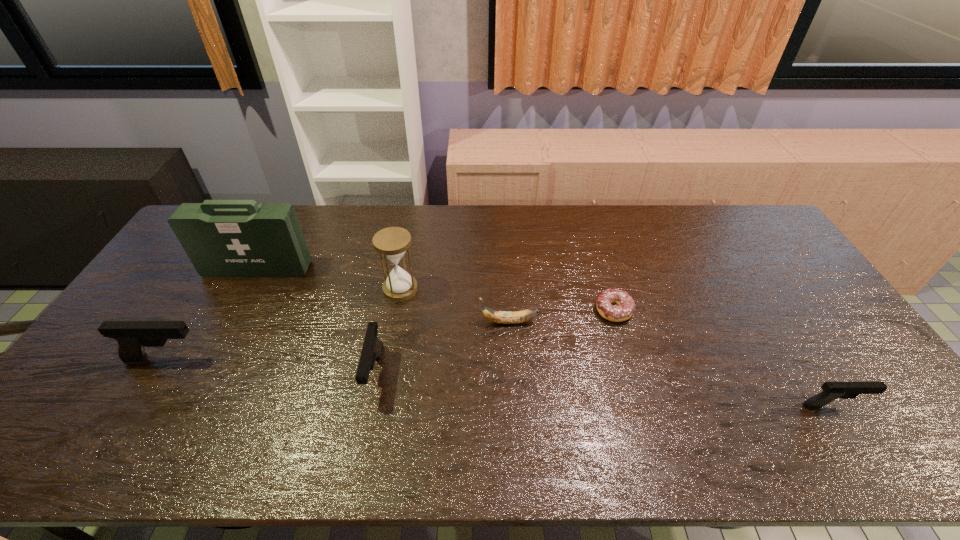
Find the location of a particular element. The height and width of the screenshot is (540, 960). banana is located at coordinates (502, 317).

This screenshot has width=960, height=540. I want to click on free spot located 0.390m on the front-facing side of the fifth shortest object, so click(351, 359).

You are a GUI agent. You are given a task and a screenshot of the screen. Output one action in this format:
    pyautogui.click(x=<x>, y=<y>)
    Task: Click on the free location located on the front-facing side of the rightmost pistol
    The width and height of the screenshot is (960, 540).
    Given the screenshot: What is the action you would take?
    pyautogui.click(x=888, y=406)

Where is `vacant space located 0.140m on the back of the second tallest object`? vacant space located 0.140m on the back of the second tallest object is located at coordinates (408, 249).

Where is `free spot located on the left of the shortest object`? Image resolution: width=960 pixels, height=540 pixels. free spot located on the left of the shortest object is located at coordinates (558, 310).

Find the location of a particular element. This screenshot has height=540, width=960. vacant point located 0.290m on the front-facing side of the first-aid kit is located at coordinates (214, 351).

Find the location of a particular element. The image size is (960, 540). vacant space located on the peel of the fifth object from left to right is located at coordinates (445, 322).

The height and width of the screenshot is (540, 960). I want to click on vacant space located 0.090m on the peel of the fifth object from left to right, so click(x=448, y=322).

This screenshot has width=960, height=540. I want to click on free spot located 0.130m on the peel of the fifth object from left to right, so click(x=435, y=322).

Locate an element on the screen. This screenshot has height=540, width=960. pistol that is at the left edge is located at coordinates (132, 337).